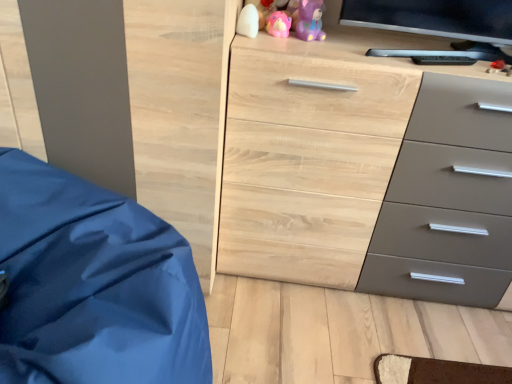
Where is `spots to the right of white matte pillow at upper center, which appears as the 1th toy when viewed from the left`? spots to the right of white matte pillow at upper center, which appears as the 1th toy when viewed from the left is located at coordinates (298, 42).